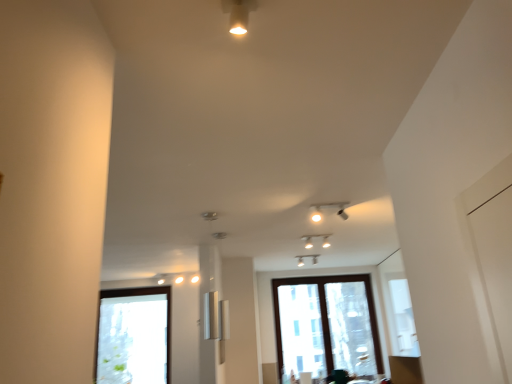
Question: Should I look upward or downward to see clear glass window at center, positioned as the 1th window in right-to-left order?

Choices:
 (A) down
 (B) up

Answer: (A)

Question: Does clear glass window at lower left, positioned as the 1th window in left-to-right order, have a lesser height compared to clear glass window at center, which is the 2th window in left-to-right order?

Choices:
 (A) no
 (B) yes

Answer: (B)

Question: Is clear glass window at lower left, the second window positioned from the right, in contact with clear glass window at center, positioned as the 1th window in right-to-left order?

Choices:
 (A) no
 (B) yes

Answer: (A)

Question: Is clear glass window at lower left, the second window positioned from the right, positioned before clear glass window at center, positioned as the 1th window in right-to-left order?

Choices:
 (A) yes
 (B) no

Answer: (A)

Question: Can you confirm if clear glass window at lower left, positioned as the 1th window in left-to-right order, is thinner than clear glass window at center, which is the 2th window in left-to-right order?

Choices:
 (A) no
 (B) yes

Answer: (A)

Question: From the image's perspective, is clear glass window at lower left, positioned as the 1th window in left-to-right order, on top of clear glass window at center, which is the 2th window in left-to-right order?

Choices:
 (A) yes
 (B) no

Answer: (B)

Question: Can we say clear glass window at lower left, positioned as the 1th window in left-to-right order, lies outside clear glass window at center, which is the 2th window in left-to-right order?

Choices:
 (A) yes
 (B) no

Answer: (A)

Question: From the image's perspective, would you say clear glass window at center, which is the 2th window in left-to-right order, is positioned over clear glass window at lower left, positioned as the 1th window in left-to-right order?

Choices:
 (A) no
 (B) yes

Answer: (B)

Question: Is clear glass window at center, positioned as the 1th window in right-to-left order, outside clear glass window at lower left, positioned as the 1th window in left-to-right order?

Choices:
 (A) no
 (B) yes

Answer: (B)

Question: Does clear glass window at center, which is the 2th window in left-to-right order, appear on the left side of clear glass window at lower left, positioned as the 1th window in left-to-right order?

Choices:
 (A) yes
 (B) no

Answer: (B)

Question: Is clear glass window at center, positioned as the 1th window in right-to-left order, wider than clear glass window at lower left, the second window positioned from the right?

Choices:
 (A) no
 (B) yes

Answer: (A)

Question: Can you confirm if clear glass window at center, positioned as the 1th window in right-to-left order, is taller than clear glass window at lower left, the second window positioned from the right?

Choices:
 (A) no
 (B) yes

Answer: (B)

Question: Is clear glass window at center, positioned as the 1th window in right-to-left order, placed right next to clear glass window at lower left, positioned as the 1th window in left-to-right order?

Choices:
 (A) yes
 (B) no

Answer: (B)

Question: Is point (297, 319) closer or farther from the camera than point (112, 372)?

Choices:
 (A) closer
 (B) farther

Answer: (B)